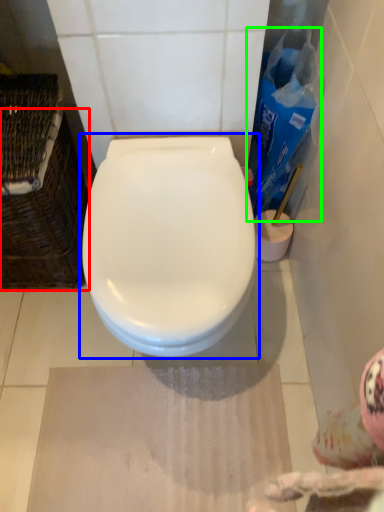
Question: Which object is the closest to the basket (highlighted by a red box)? Choose among these: toilet (highlighted by a blue box) or cleaning product (highlighted by a green box).

Choices:
 (A) toilet
 (B) cleaning product

Answer: (A)